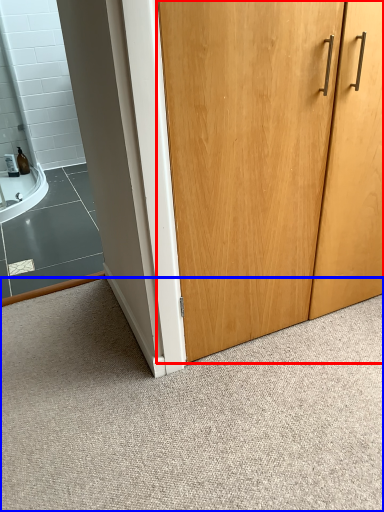
Question: Which object is closer to the camera taking this photo, door (highlighted by a red box) or granite (highlighted by a blue box)?

Choices:
 (A) door
 (B) granite

Answer: (B)